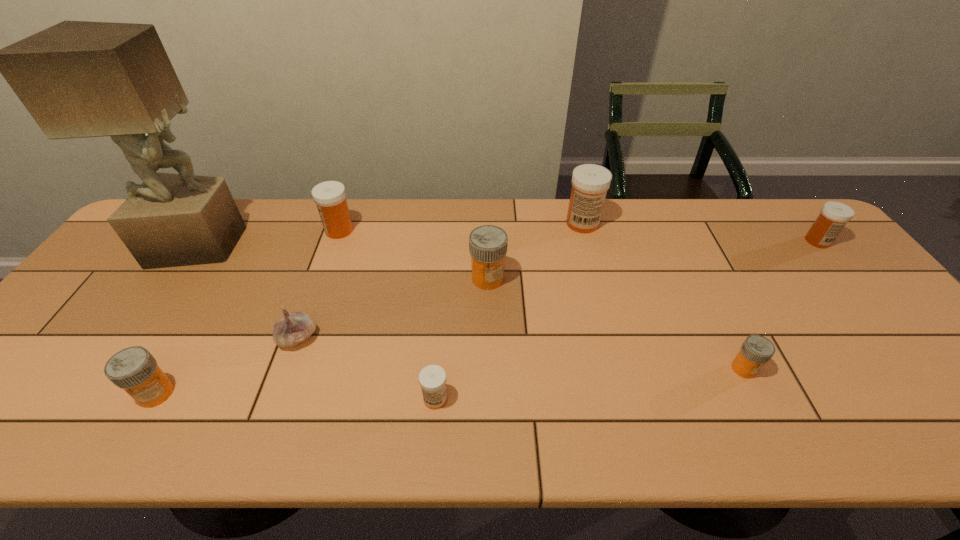
Where is `object that is positioned at the far right corner`? This screenshot has width=960, height=540. object that is positioned at the far right corner is located at coordinates (834, 215).

I want to click on free region at the far edge of the desktop, so click(529, 199).

Find the location of a particular element. vacant area at the near edge is located at coordinates (621, 436).

This screenshot has height=540, width=960. What are the coordinates of `vacant position at the left edge of the desktop` in the screenshot? It's located at (58, 364).

This screenshot has width=960, height=540. Find the location of `vacant space at the right edge`. vacant space at the right edge is located at coordinates (853, 300).

Find the location of `vacant space at the far right corner`. vacant space at the far right corner is located at coordinates (768, 214).

I want to click on free space between the second smallest orange medicine and the third smallest white medicine, so 248,312.

At what (x,y) coordinates should I click in order to perform the action: click on free point between the rightmost medicine and the second medicine from right to left. Please return your answer as a coordinate pair (x, y). The image size is (960, 540). Looking at the image, I should click on 780,305.

This screenshot has width=960, height=540. What are the coordinates of `vacant point located between the white garlic and the second medicine from right to left` in the screenshot? It's located at (520, 353).

Where is `blank region between the biggest orange medicine and the biggest white medicine`? The height and width of the screenshot is (540, 960). blank region between the biggest orange medicine and the biggest white medicine is located at coordinates (535, 251).